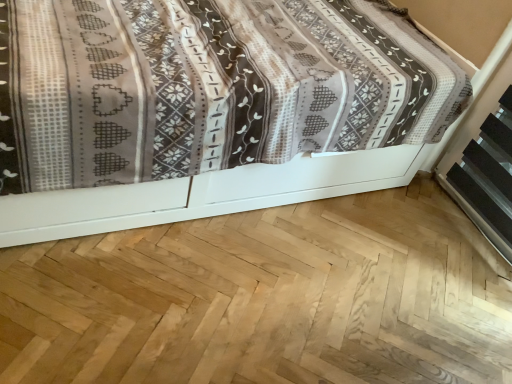
Describe the element at coordinates (219, 109) in the screenshot. This screenshot has width=512, height=384. I see `patterned fabric bed at upper left` at that location.

Locate an element on the screen. This screenshot has width=512, height=384. patterned fabric bed at upper left is located at coordinates (219, 109).

You are a GUI agent. You are given a task and a screenshot of the screen. Output one action in this format:
    pyautogui.click(x=<x>, y=<y>)
    Task: Click on the patterned fabric bed at upper left
    This screenshot has width=512, height=384.
    Given the screenshot: What is the action you would take?
    pyautogui.click(x=219, y=109)